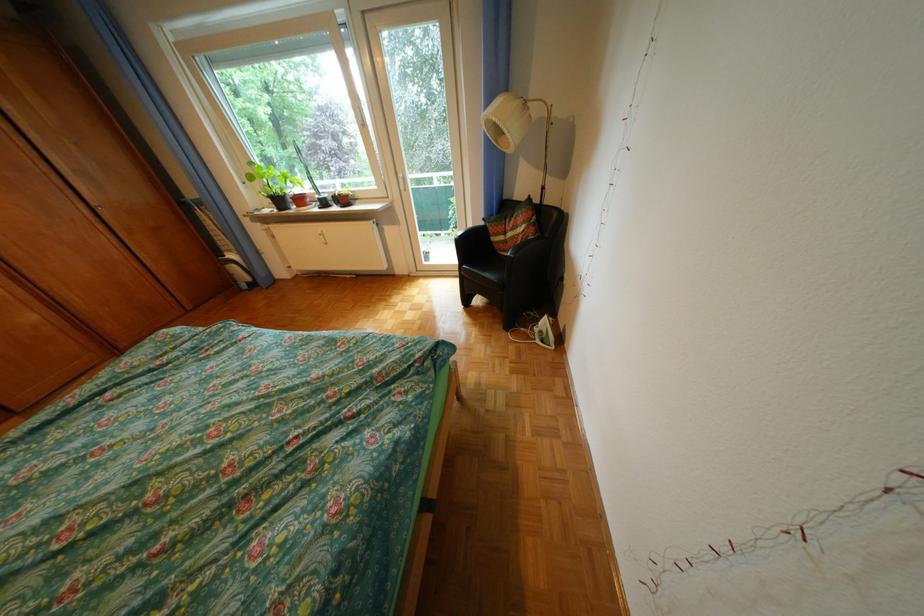
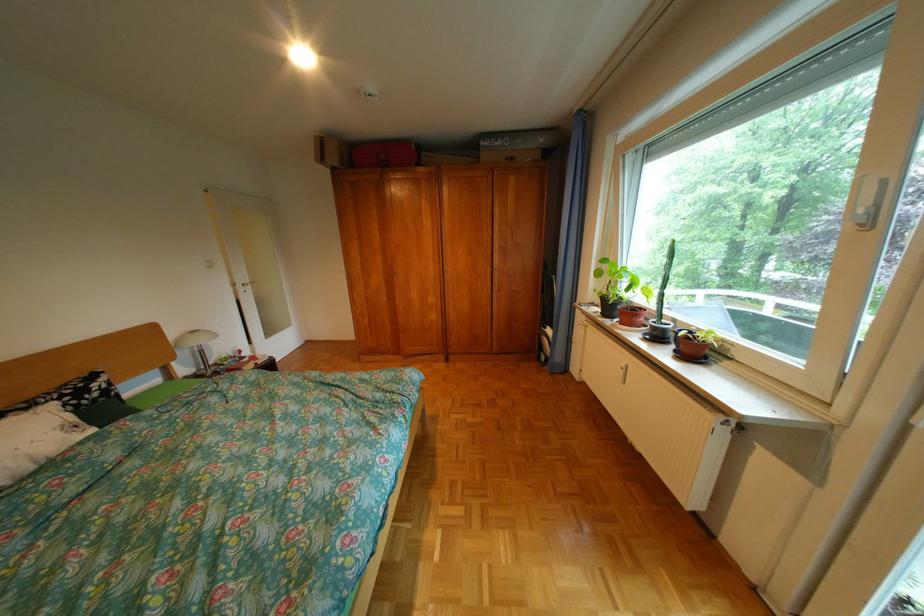
Locate, in the second image, the point that corresponds to pixel 331 209 in the first image.

(650, 338)